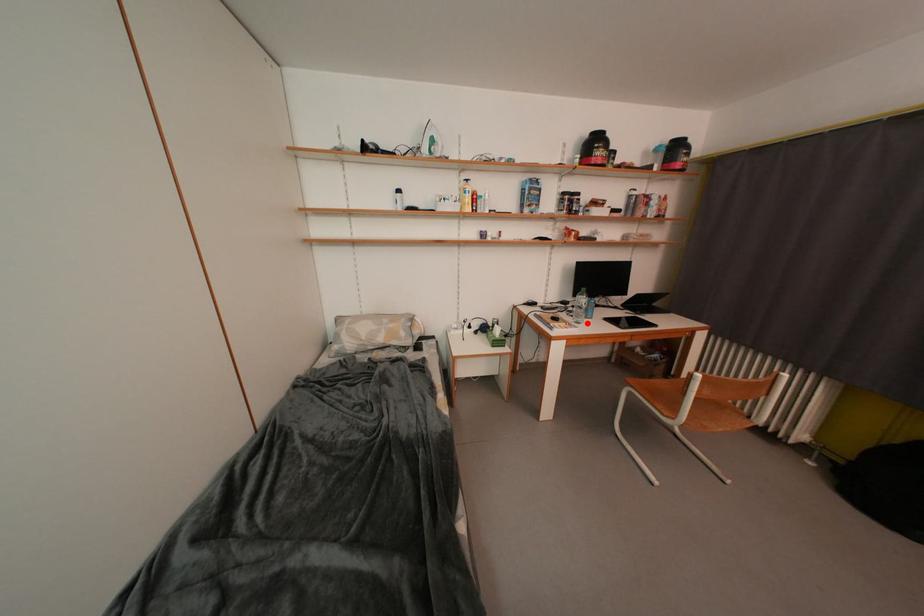
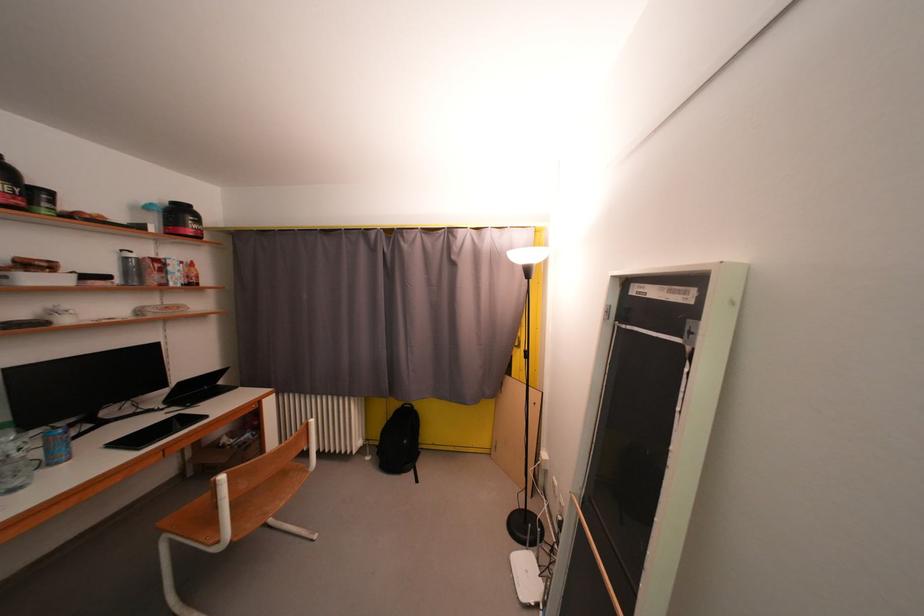
Question: A red point is marked in image1. In image2, is the corresponding 3D point closer to the camera or farther? Reply with the corresponding letter.

Choices:
 (A) The corresponding 3D point is closer.
 (B) The corresponding 3D point is farther.

Answer: (A)